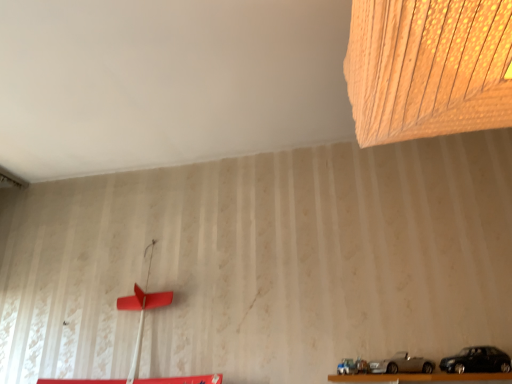
Question: Should I look upward or downward to see black matte car at lower right, which appears as the 1th car when viewed from the right?

Choices:
 (A) down
 (B) up

Answer: (A)

Question: From the image's perspective, is wooden textured lampshade at upper right above black matte car at lower right, which appears as the 1th car when viewed from the right?

Choices:
 (A) no
 (B) yes

Answer: (B)

Question: Can you confirm if wooden textured lampshade at upper right is smaller than black matte car at lower right, the second car when ordered from left to right?

Choices:
 (A) yes
 (B) no

Answer: (B)

Question: From a real-world perspective, is wooden textured lampshade at upper right positioned over black matte car at lower right, the second car when ordered from left to right, based on gravity?

Choices:
 (A) yes
 (B) no

Answer: (A)

Question: Is the surface of wooden textured lampshade at upper right in direct contact with black matte car at lower right, which appears as the 1th car when viewed from the right?

Choices:
 (A) no
 (B) yes

Answer: (A)

Question: Is wooden textured lampshade at upper right bigger than black matte car at lower right, the second car when ordered from left to right?

Choices:
 (A) no
 (B) yes

Answer: (B)

Question: Is wooden textured lampshade at upper right surrounding black matte car at lower right, the second car when ordered from left to right?

Choices:
 (A) no
 (B) yes

Answer: (A)

Question: From a real-world perspective, is black matte car at lower right, which appears as the 1th car when viewed from the right, beneath wooden textured lampshade at upper right?

Choices:
 (A) no
 (B) yes

Answer: (B)

Question: Would you say wooden textured lampshade at upper right is part of black matte car at lower right, the second car when ordered from left to right,'s contents?

Choices:
 (A) yes
 (B) no

Answer: (B)

Question: Considering the relative sizes of black matte car at lower right, which appears as the 1th car when viewed from the right, and wooden textured lampshade at upper right in the image provided, is black matte car at lower right, which appears as the 1th car when viewed from the right, wider than wooden textured lampshade at upper right?

Choices:
 (A) yes
 (B) no

Answer: (B)

Question: Is black matte car at lower right, which appears as the 1th car when viewed from the right, in front of wooden textured lampshade at upper right?

Choices:
 (A) no
 (B) yes

Answer: (A)

Question: Is black matte car at lower right, which appears as the 1th car when viewed from the right, not inside wooden textured lampshade at upper right?

Choices:
 (A) yes
 (B) no

Answer: (A)

Question: Does black matte car at lower right, the second car when ordered from left to right, have a lesser width compared to wooden textured lampshade at upper right?

Choices:
 (A) yes
 (B) no

Answer: (A)

Question: Is silver metallic car at lower center, the 2th car positioned from the right, touching black matte car at lower right, which appears as the 1th car when viewed from the right?

Choices:
 (A) yes
 (B) no

Answer: (B)